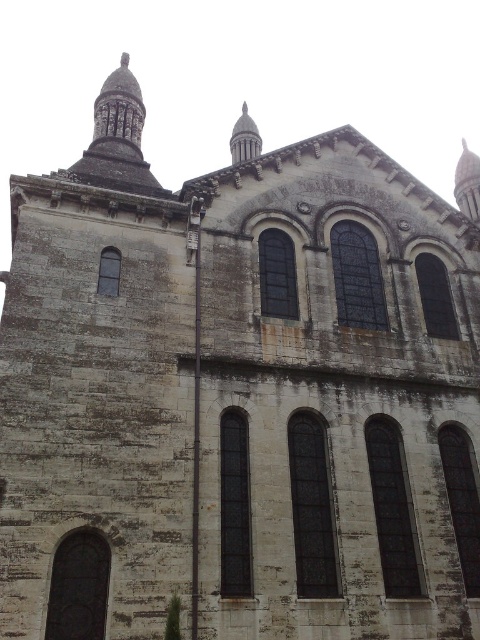
You are standing in front of the historic stone building. There is a smooth gray spire at upper right represented by point (x=468, y=182). Where would you look to find the smooth gray spire at upper right?

The smooth gray spire at upper right is located at the coordinates point (x=468, y=182).

You are standing in front of the historic stone building and want to take a photo that includes both the smooth gray spire at upper right and the smooth gray stone spire at upper center. Which spire will appear larger in your photo?

The smooth gray spire at upper right will appear larger in the photo because it is closer to the viewer than the smooth gray stone spire at upper center.

You are standing in front of the historic stone building and want to take a photo. There are two points marked on the building. One is at coordinates point [455,168] and the other is at point [251,129]. Which point is closer to you?

Point [251,129] is closer to you because it is in front of point [455,168].